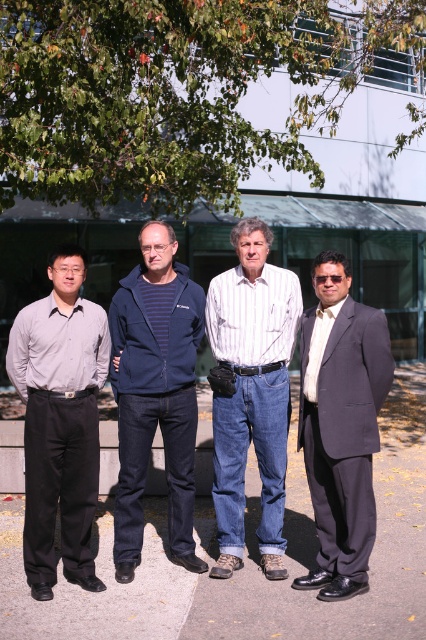
Question: Does green leafy tree at upper center come behind matte gray shirt at left?

Choices:
 (A) no
 (B) yes

Answer: (B)

Question: From the image, what is the correct spatial relationship of green leafy tree at upper center in relation to matte gray shirt at left?

Choices:
 (A) right
 (B) left

Answer: (A)

Question: Among these objects, which one is farthest from the camera?

Choices:
 (A) navy blue jacket at center
 (B) dark blue suit at right
 (C) striped cotton shirt at center

Answer: (A)

Question: Which object is the closest to the dark blue suit at right?

Choices:
 (A) striped cotton shirt at center
 (B) green leafy tree at upper center

Answer: (A)

Question: Which is nearer to the striped cotton shirt at center?

Choices:
 (A) navy blue jacket at center
 (B) dark blue suit at right
 (C) matte gray shirt at left

Answer: (A)

Question: Does green leafy tree at upper center appear on the left side of navy blue jacket at center?

Choices:
 (A) yes
 (B) no

Answer: (B)